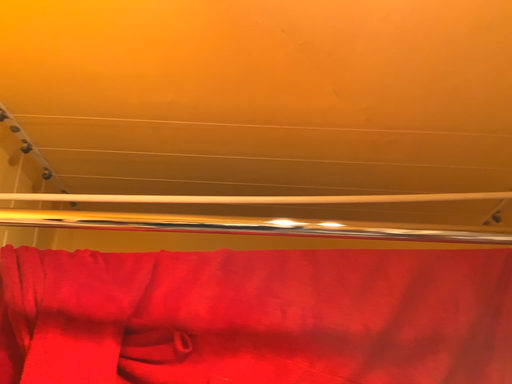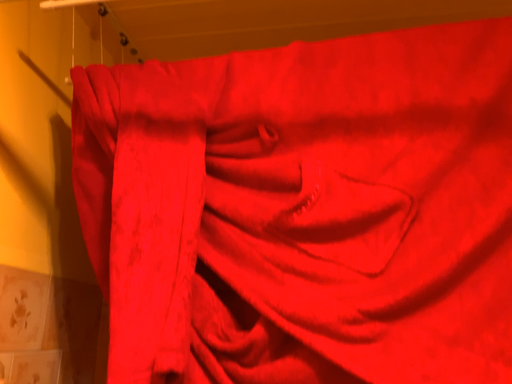
Question: Which way did the camera rotate in the video?

Choices:
 (A) rotated right
 (B) rotated left

Answer: (B)